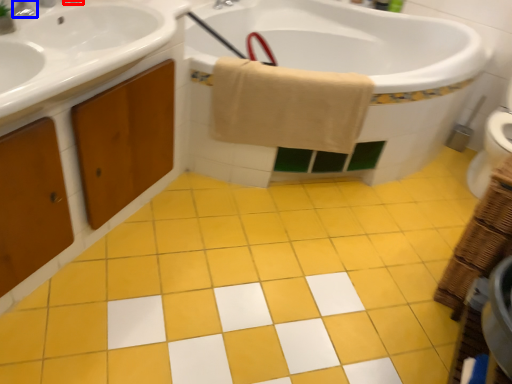
Question: Among these objects, which one is farthest to the camera, faucet (highlighted by a red box) or tap (highlighted by a blue box)?

Choices:
 (A) faucet
 (B) tap

Answer: (A)